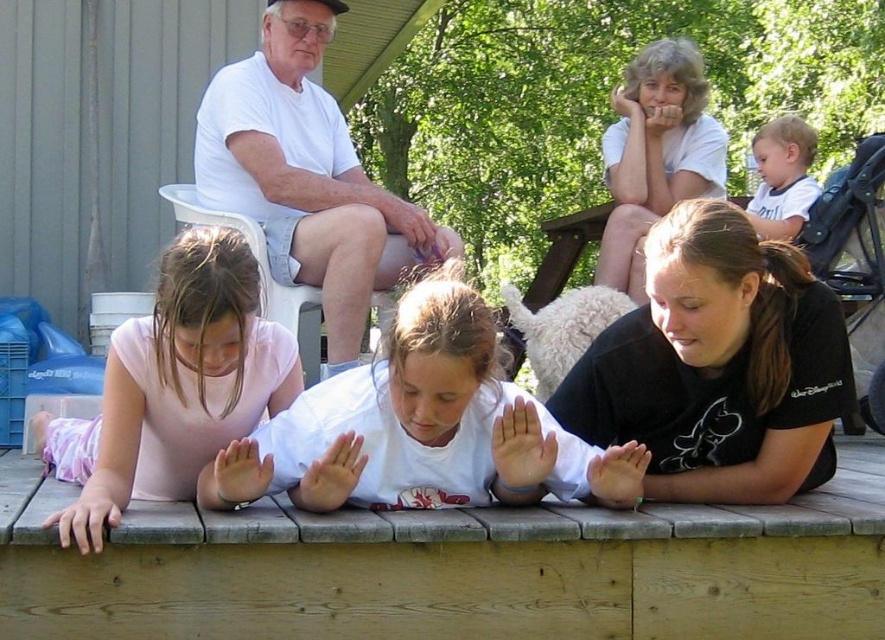
Which of these two, white matte shirt at upper center or light blue shirt at upper right, stands taller?

white matte shirt at upper center

Is white matte shirt at upper center below light blue shirt at upper right?

Incorrect, white matte shirt at upper center is not positioned below light blue shirt at upper right.

Is point (666, 196) farther from camera compared to point (814, 186)?

No, it is in front of (814, 186).

Image resolution: width=885 pixels, height=640 pixels. What are the coordinates of `white matte shirt at upper center` in the screenshot? It's located at (655, 154).

Does wooden at lower center appear over black matte shirt at lower right?

No.

Does wooden at lower center lie in front of black matte shirt at lower right?

Yes.

Locate an element on the screen. This screenshot has height=640, width=885. wooden at lower center is located at coordinates (455, 568).

Is point (358, 588) behind point (599, 276)?

No, it is in front of (599, 276).

Which is in front, point (129, 531) or point (667, 113)?

Point (129, 531) is more forward.

The height and width of the screenshot is (640, 885). I want to click on wooden at lower center, so click(x=455, y=568).